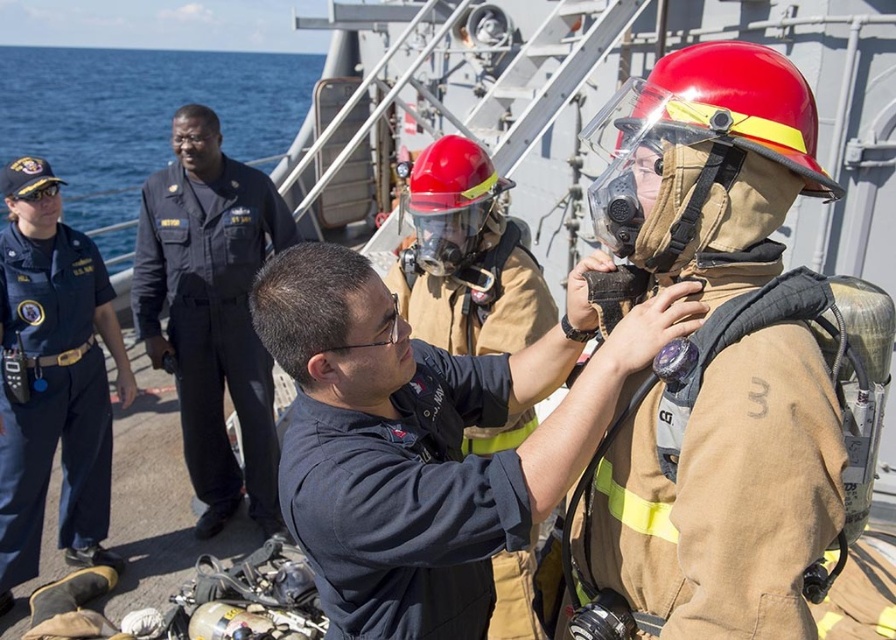
You are a crew member on the ship and need to locate the nearest emergency equipment. You are currently standing at point (725, 497). What is the nearest object to your current position?

The nearest object to your current position at point (725, 497) is the matte khaki uniform at center located exactly at that point.

You are on a ship and need to locate the matte khaki uniform at center. According to the coordinates provided, where would you find it?

The matte khaki uniform at center is located at coordinates point [725,497].